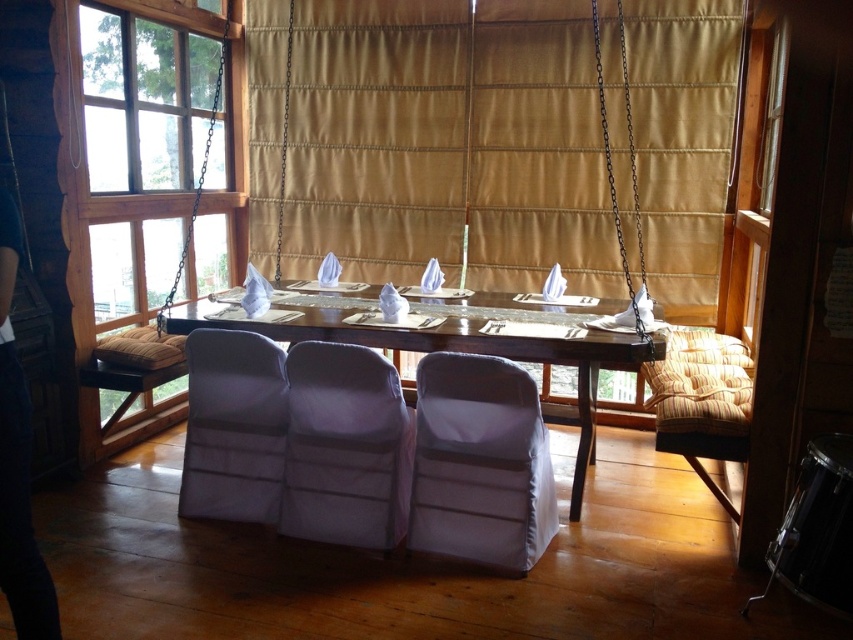
Question: Does white fabric chair at center have a lesser width compared to gold fabric curtain at center?

Choices:
 (A) yes
 (B) no

Answer: (B)

Question: Which of the following is the closest to the observer?

Choices:
 (A) transparent glass window at upper left
 (B) white fabric chair at center
 (C) matte white armchair at center
 (D) gold fabric curtain at center

Answer: (B)

Question: Estimate the real-world distances between objects in this image. Which object is closer to the white fabric chair at center?

Choices:
 (A) wooden table at center
 (B) gold fabric curtain at center

Answer: (A)

Question: Can you confirm if transparent glass window at upper left is thinner than gold fabric curtain at center?

Choices:
 (A) no
 (B) yes

Answer: (B)

Question: Is white fabric chair at center positioned behind gold fabric curtain at center?

Choices:
 (A) yes
 (B) no

Answer: (B)

Question: Which of the following is the closest to the observer?

Choices:
 (A) (279, 388)
 (B) (321, 365)
 (C) (602, 120)
 (D) (469, 481)

Answer: (D)